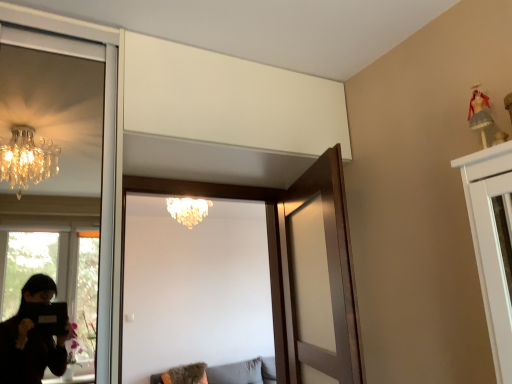
Question: Is the depth of crystal chandelier at upper center greater than that of wooden door at center, acting as the 2th door starting from the right?

Choices:
 (A) yes
 (B) no

Answer: (A)

Question: Is crystal chandelier at upper center bigger than wooden door at center, acting as the 2th door starting from the right?

Choices:
 (A) yes
 (B) no

Answer: (B)

Question: Is wooden door at center, placed as the 1th door when sorted from left to right, at the back of crystal chandelier at upper center?

Choices:
 (A) no
 (B) yes

Answer: (A)

Question: From a real-world perspective, is crystal chandelier at upper center physically above wooden door at center, acting as the 2th door starting from the right?

Choices:
 (A) yes
 (B) no

Answer: (A)

Question: Could you tell me if crystal chandelier at upper center is turned towards wooden door at center, acting as the 2th door starting from the right?

Choices:
 (A) no
 (B) yes

Answer: (A)

Question: Can you confirm if crystal chandelier at upper center is taller than wooden door at center, placed as the 1th door when sorted from left to right?

Choices:
 (A) yes
 (B) no

Answer: (B)

Question: From a real-world perspective, is wooden door at center, acting as the 2th door starting from the right, under gray fabric couch at lower center?

Choices:
 (A) no
 (B) yes

Answer: (A)

Question: Is the position of wooden door at center, acting as the 2th door starting from the right, less distant than that of gray fabric couch at lower center?

Choices:
 (A) no
 (B) yes

Answer: (B)

Question: Is wooden door at center, placed as the 1th door when sorted from left to right, completely or partially outside of gray fabric couch at lower center?

Choices:
 (A) no
 (B) yes

Answer: (B)

Question: Is wooden door at center, placed as the 1th door when sorted from left to right, thinner than gray fabric couch at lower center?

Choices:
 (A) no
 (B) yes

Answer: (B)

Question: From the image's perspective, is wooden door at center, acting as the 2th door starting from the right, over gray fabric couch at lower center?

Choices:
 (A) no
 (B) yes

Answer: (B)

Question: From the image's perspective, would you say wooden door at center, placed as the 1th door when sorted from left to right, is shown under gray fabric couch at lower center?

Choices:
 (A) no
 (B) yes

Answer: (A)

Question: Would you say wooden door at center, which ranks as the 2th door in left-to-right order, is outside wooden door at center, acting as the 2th door starting from the right?

Choices:
 (A) no
 (B) yes

Answer: (B)